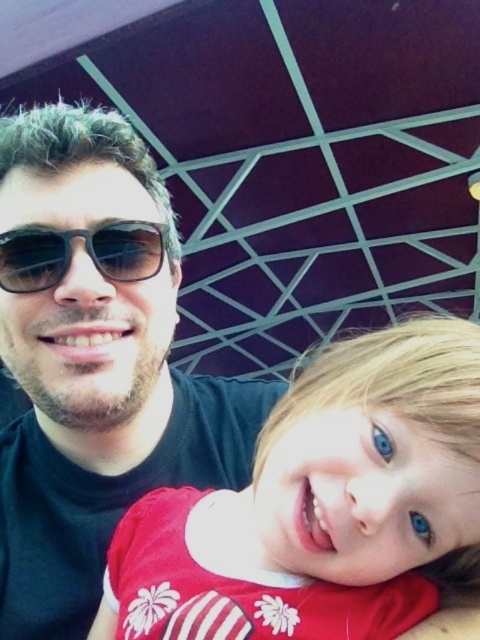
Question: Is matte red shirt at center to the left of shiny brown aviator sunglasses at center from the viewer's perspective?

Choices:
 (A) yes
 (B) no

Answer: (B)

Question: Which of these objects is positioned closest to the matte black sunglasses at upper left?

Choices:
 (A) shiny brown aviator sunglasses at center
 (B) matte red shirt at center

Answer: (A)

Question: Is matte black sunglasses at upper left to the right of shiny brown aviator sunglasses at center from the viewer's perspective?

Choices:
 (A) yes
 (B) no

Answer: (B)

Question: Which object is the closest to the matte red shirt at center?

Choices:
 (A) shiny brown aviator sunglasses at center
 (B) matte black sunglasses at upper left

Answer: (B)

Question: Which of these objects is positioned farthest from the matte black sunglasses at upper left?

Choices:
 (A) shiny brown aviator sunglasses at center
 (B) matte red shirt at center

Answer: (B)

Question: Does matte red shirt at center come behind shiny brown aviator sunglasses at center?

Choices:
 (A) no
 (B) yes

Answer: (A)